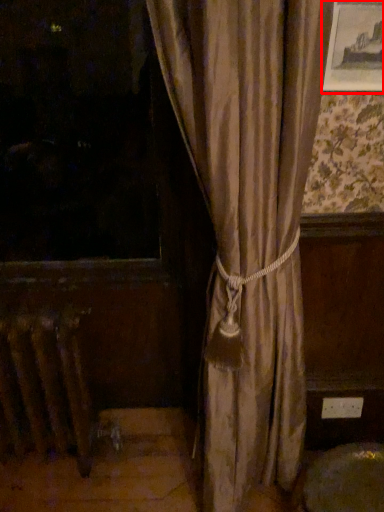
Question: From the image's perspective, what is the correct spatial relationship of picture frame (annotated by the red box) in relation to radiator?

Choices:
 (A) above
 (B) below

Answer: (A)